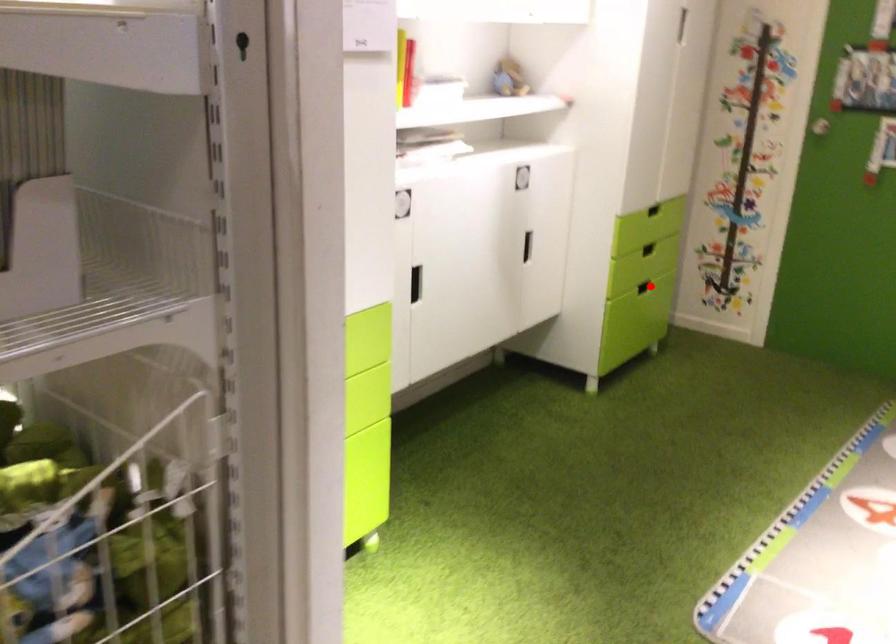
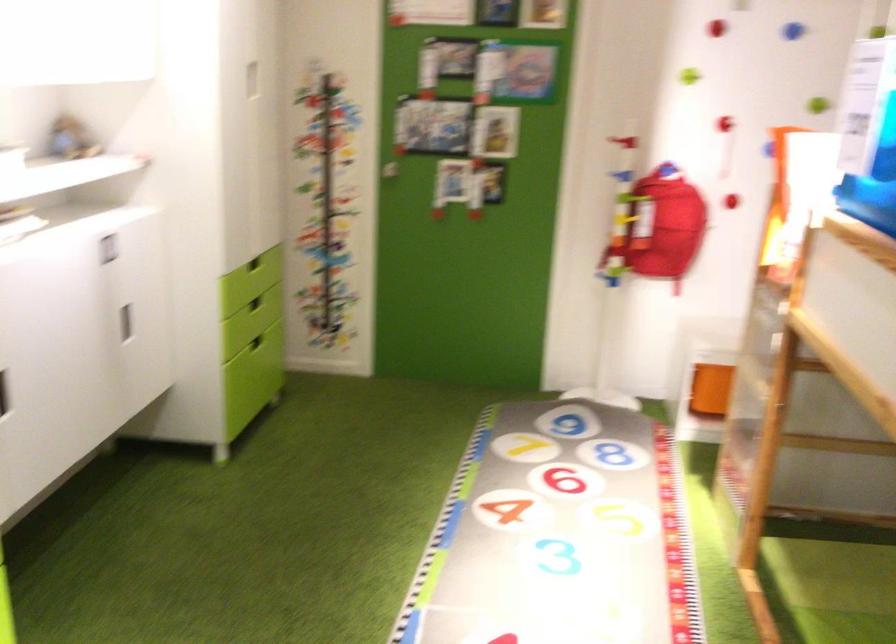
Find the pixel in the second image that matches the highlighted location in the first image.

(255, 342)